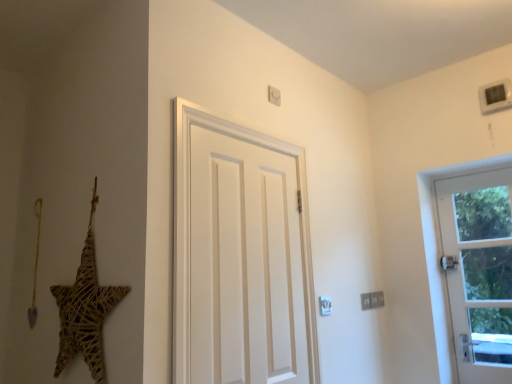
In order to face white glass door at right, the 1th door positioned from the back, should I rotate leftwards or rightwards?

Rotate right and turn 28.460 degrees.

The image size is (512, 384). I want to click on woven straw star at left, so click(85, 310).

This screenshot has width=512, height=384. I want to click on door above the woven straw star at left (from a real-world perspective), so click(x=247, y=265).

Can you confirm if woven straw star at left is bigger than white matte door at center, which appears as the first door when viewed from the left?

Correct, woven straw star at left is larger in size than white matte door at center, which appears as the first door when viewed from the left.

From the picture: Which of these two, woven straw star at left or white matte door at center, placed as the second door when sorted from back to front, stands shorter?

With less height is woven straw star at left.

From the image's perspective, which one is positioned higher, white glass door at right, which is the 2th door from front to back, or white matte door at center, the 2th door in the right-to-left sequence?

white matte door at center, the 2th door in the right-to-left sequence, appears higher in the image.

Can we say white glass door at right, which is the 2th door from front to back, lies outside white matte door at center, which appears as the first door when viewed from the left?

Yes, white glass door at right, which is the 2th door from front to back, is located beyond the bounds of white matte door at center, which appears as the first door when viewed from the left.

You are a GUI agent. You are given a task and a screenshot of the screen. Output one action in this format:
    pyautogui.click(x=<x>, y=<y>)
    Task: Click on the door that appears on the right of white matte door at center, which appears as the first door when viewed from the left
    
    Given the screenshot: What is the action you would take?
    pyautogui.click(x=479, y=271)

Does point (474, 237) come in front of point (272, 237)?

No.

Is white glass door at right, the first door from the right, thinner than woven straw star at left?

No, white glass door at right, the first door from the right, is not thinner than woven straw star at left.

Can you confirm if white glass door at right, placed as the 2th door when sorted from left to right, is positioned to the left of woven straw star at left?

Incorrect, white glass door at right, placed as the 2th door when sorted from left to right, is not on the left side of woven straw star at left.

Based on the photo, which of these two, white glass door at right, the first door from the right, or woven straw star at left, stands taller?

white glass door at right, the first door from the right, is taller.

Locate an element on the screen. star in front of the white glass door at right, which is the 2th door from front to back is located at coordinates (85, 310).

In the scene shown: From a real-world perspective, is white matte door at center, which appears as the first door when viewed from the left, positioned under white glass door at right, which is the 2th door from front to back, based on gravity?

→ Incorrect, from a real-world perspective, white matte door at center, which appears as the first door when viewed from the left, is higher than white glass door at right, which is the 2th door from front to back.

From the picture: Considering their positions, is white matte door at center, which appears as the first door when viewed from the left, located in front of or behind white glass door at right, the first door from the right?

white matte door at center, which appears as the first door when viewed from the left, is in front of white glass door at right, the first door from the right.

Is white matte door at center, the 2th door in the right-to-left sequence, turned away from white glass door at right, placed as the 2th door when sorted from left to right?

No, white matte door at center, the 2th door in the right-to-left sequence, is not facing away from white glass door at right, placed as the 2th door when sorted from left to right.

Identify the location of door behind the white matte door at center, the 1th door in the front-to-back sequence. (479, 271).

Is woven straw star at left turned away from white glass door at right, which is the 2th door from front to back?

That's right, woven straw star at left is facing away from white glass door at right, which is the 2th door from front to back.

In order to click on star that is on the left side of white glass door at right, the first door from the right in this screenshot , I will do `click(85, 310)`.

Can you confirm if woven straw star at left is shorter than white glass door at right, the first door from the right?

Yes.

How distant is woven straw star at left from white glass door at right, placed as the 2th door when sorted from left to right?

A distance of 2.08 meters exists between woven straw star at left and white glass door at right, placed as the 2th door when sorted from left to right.

From the image's perspective, is white matte door at center, the 2th door in the right-to-left sequence, located above or below woven straw star at left?

Clearly, from the image's perspective, white matte door at center, the 2th door in the right-to-left sequence, is above woven straw star at left.

Considering the relative positions of white matte door at center, placed as the second door when sorted from back to front, and woven straw star at left in the image provided, is white matte door at center, placed as the second door when sorted from back to front, in front of woven straw star at left?

No, it is not.

Does white matte door at center, the 2th door in the right-to-left sequence, have a greater height compared to woven straw star at left?

Indeed, white matte door at center, the 2th door in the right-to-left sequence, has a greater height compared to woven straw star at left.

Is woven straw star at left at the back of white matte door at center, which appears as the first door when viewed from the left?

white matte door at center, which appears as the first door when viewed from the left, does not have its back to woven straw star at left.

Find the location of `star that appears below the white matte door at center, which appears as the first door when viewed from the left (from a real-world perspective)`. star that appears below the white matte door at center, which appears as the first door when viewed from the left (from a real-world perspective) is located at coordinates (85, 310).

Locate an element on the screen. This screenshot has width=512, height=384. door below the white matte door at center, the 1th door in the front-to-back sequence (from the image's perspective) is located at coordinates (479, 271).

Estimate the real-world distances between objects in this image. Which object is further from white glass door at right, the first door from the right, woven straw star at left or white matte door at center, the 2th door in the right-to-left sequence?

The object further to white glass door at right, the first door from the right, is woven straw star at left.

From the image, which object appears to be farther from white matte door at center, the 2th door in the right-to-left sequence, white glass door at right, which is the 2th door from front to back, or woven straw star at left?

white glass door at right, which is the 2th door from front to back, is further to white matte door at center, the 2th door in the right-to-left sequence.

Looking at the image, which one is located closer to white matte door at center, the 1th door in the front-to-back sequence, woven straw star at left or white glass door at right, placed as the 2th door when sorted from left to right?

woven straw star at left lies closer to white matte door at center, the 1th door in the front-to-back sequence, than the other object.

When comparing their distances from white glass door at right, the 1th door positioned from the back, does white matte door at center, the 2th door in the right-to-left sequence, or woven straw star at left seem further?

The object further to white glass door at right, the 1th door positioned from the back, is woven straw star at left.

Looking at this image, estimate the real-world distances between objects in this image. Which object is further from woven straw star at left, white matte door at center, the 2th door in the right-to-left sequence, or white glass door at right, the first door from the right?

white glass door at right, the first door from the right, is positioned further to the anchor woven straw star at left.

When comparing their distances from woven straw star at left, does white glass door at right, the 1th door positioned from the back, or white matte door at center, which appears as the first door when viewed from the left, seem closer?

white matte door at center, which appears as the first door when viewed from the left, lies closer to woven straw star at left than the other object.

I want to click on door between woven straw star at left and white glass door at right, the 1th door positioned from the back, so click(x=247, y=265).